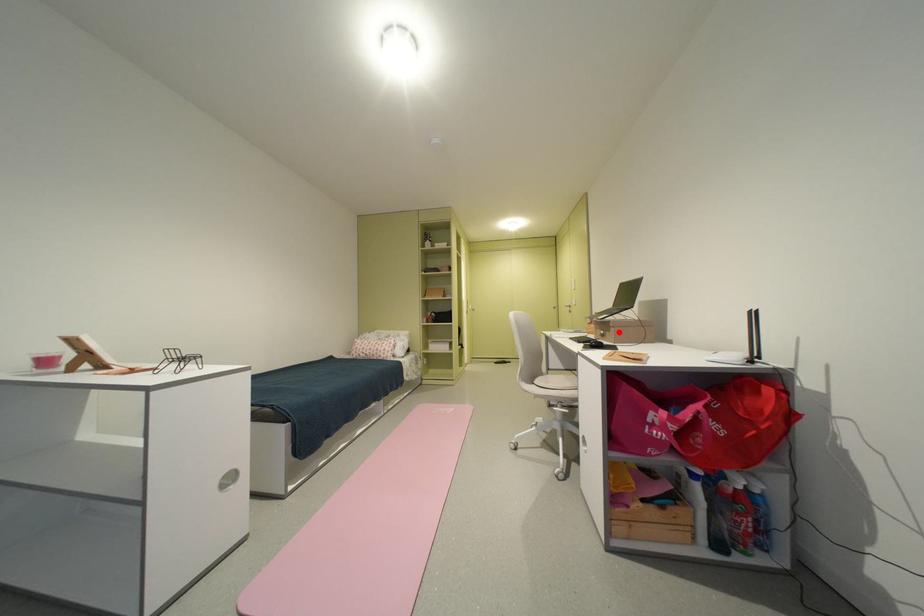
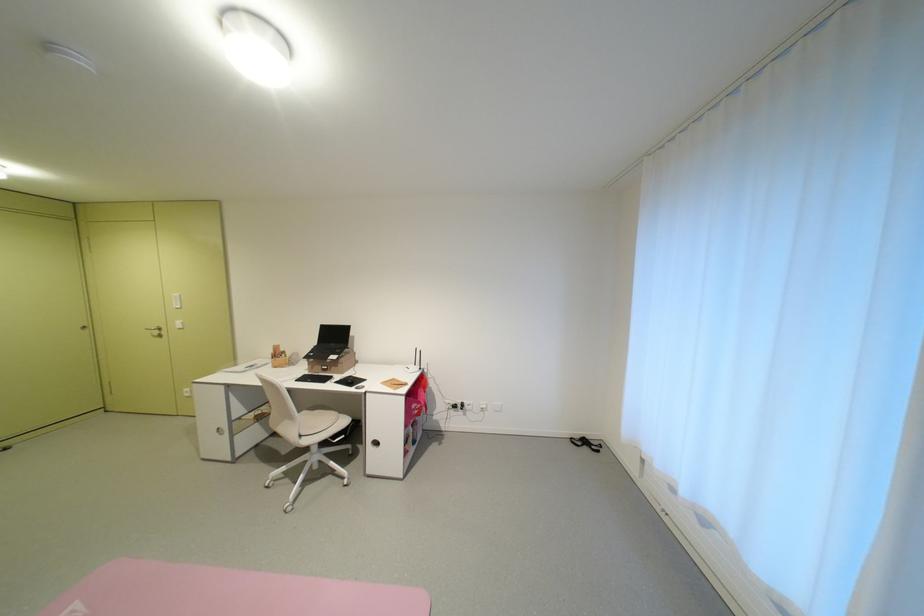
Where in the second image is the point corresponding to the highlighted location from the first image?

(346, 368)